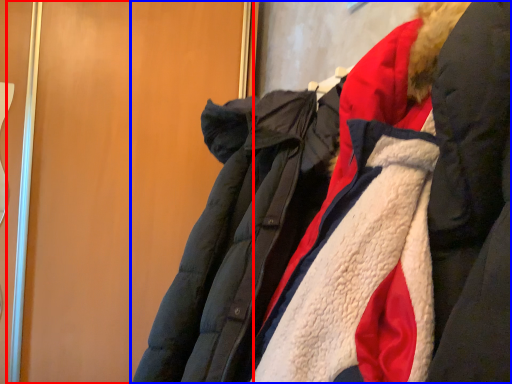
Question: Among these objects, which one is farthest to the camera, door (highlighted by a red box) or jacket (highlighted by a blue box)?

Choices:
 (A) door
 (B) jacket

Answer: (A)